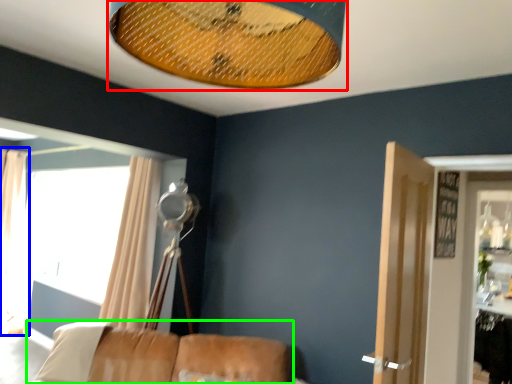
Question: Which object is the closest to the lamp (highlighted by a red box)? Choose among these: curtain (highlighted by a blue box) or furniture (highlighted by a green box).

Choices:
 (A) curtain
 (B) furniture

Answer: (B)